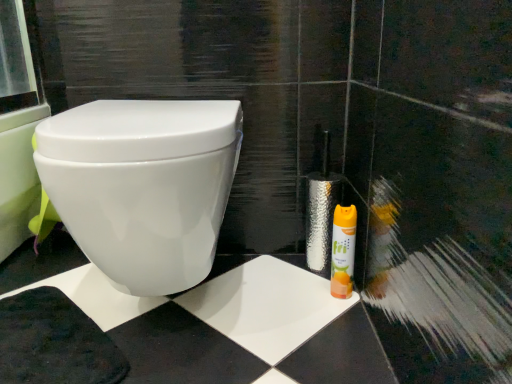
You are a GUI agent. You are given a task and a screenshot of the screen. Output one action in this format:
    pyautogui.click(x=<x>, y=<y>)
    Task: Click on the vacant area on the back side of yellow matte canister at lower right
    
    Given the screenshot: What is the action you would take?
    pyautogui.click(x=301, y=265)